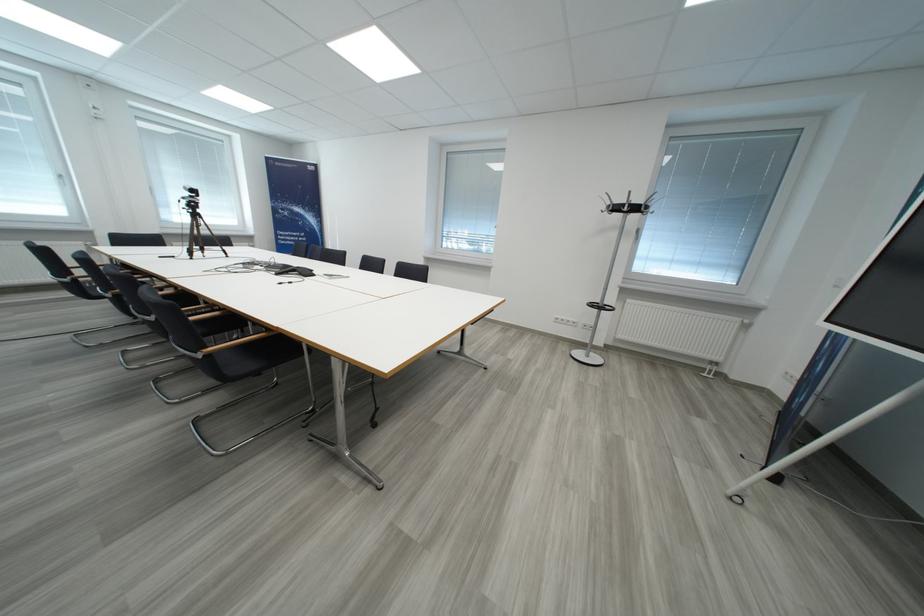
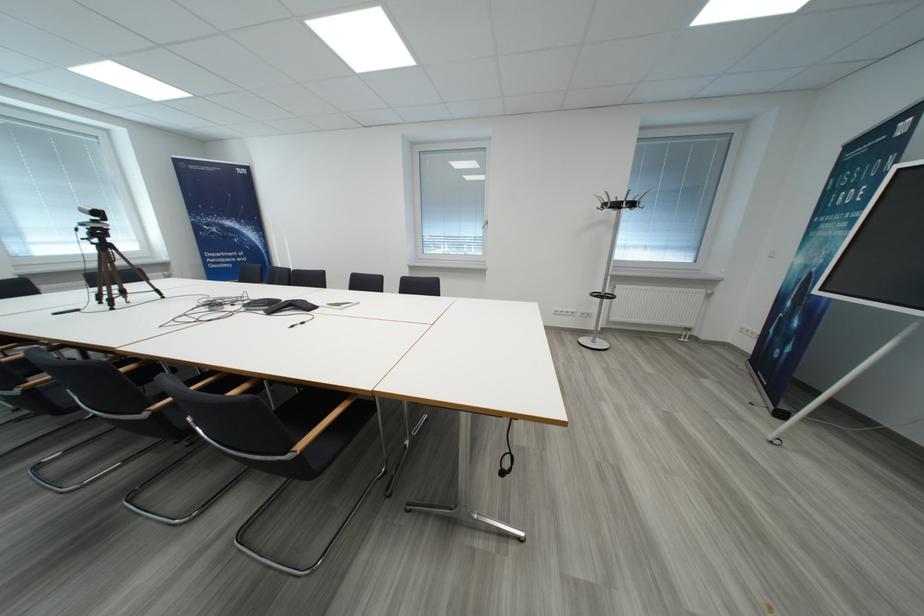
Locate, in the second image, the point that corresponds to [207,359] in the first image.

(296, 460)